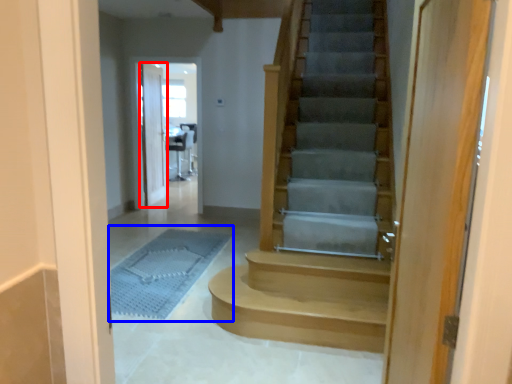
Question: Which point is closer to the camera, door (highlighted by a red box) or bath mat (highlighted by a blue box)?

Choices:
 (A) door
 (B) bath mat

Answer: (B)